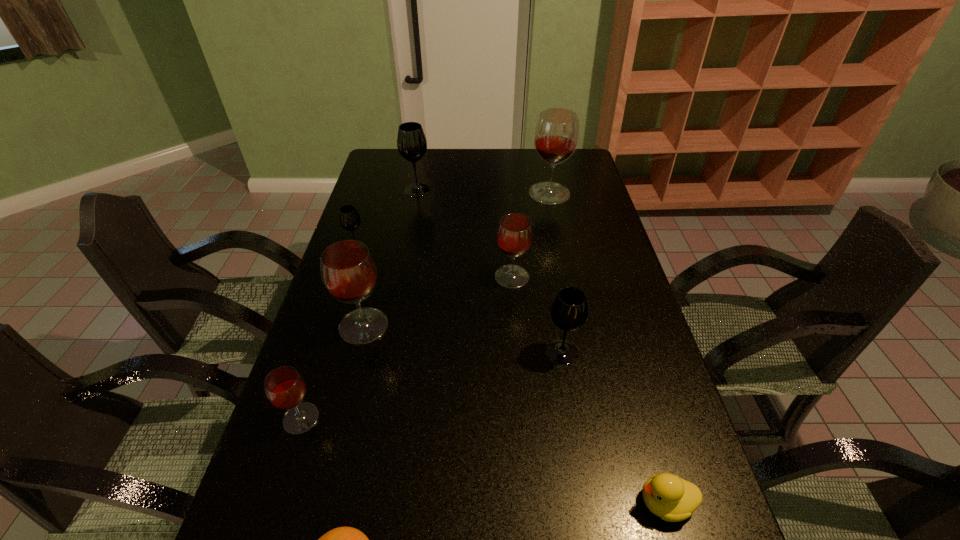
Locate which red wineglass ranks third in proximity to the second nearest red wineglass. Please provide its 2D coordinates. Your answer should be formatted as a tuple, i.e. [(x, y)], where the tuple contains the x and y coordinates of a point satisfying the conditions above.

[(556, 136)]

This screenshot has width=960, height=540. Identify the location of the third closest gray wineglass to the second nearest object. (411, 141).

Select which gray wineglass appears as the second closest to the third farthest red wineglass. Please provide its 2D coordinates. Your answer should be formatted as a tuple, i.e. [(x, y)], where the tuple contains the x and y coordinates of a point satisfying the conditions above.

[(569, 311)]

At what (x,y) coordinates should I click in order to perform the action: click on free space that satisfies the following two spatial constraints: 1. on the front side of the second gray wineglass from left to right; 2. on the right side of the tallest object. Please return your answer as a coordinate pair (x, y). Image resolution: width=960 pixels, height=540 pixels. Looking at the image, I should click on (417, 193).